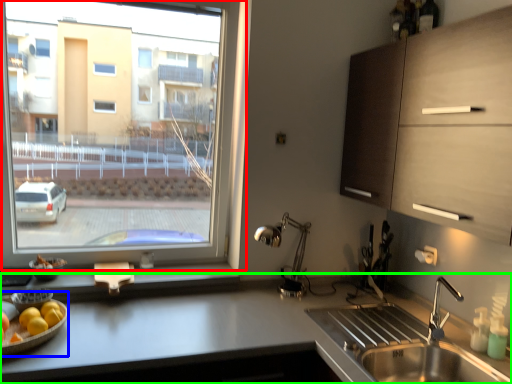
Question: Which is farther away from window (highlighted by a red box)? fruit dish (highlighted by a blue box) or countertop (highlighted by a green box)?

Choices:
 (A) fruit dish
 (B) countertop

Answer: (A)